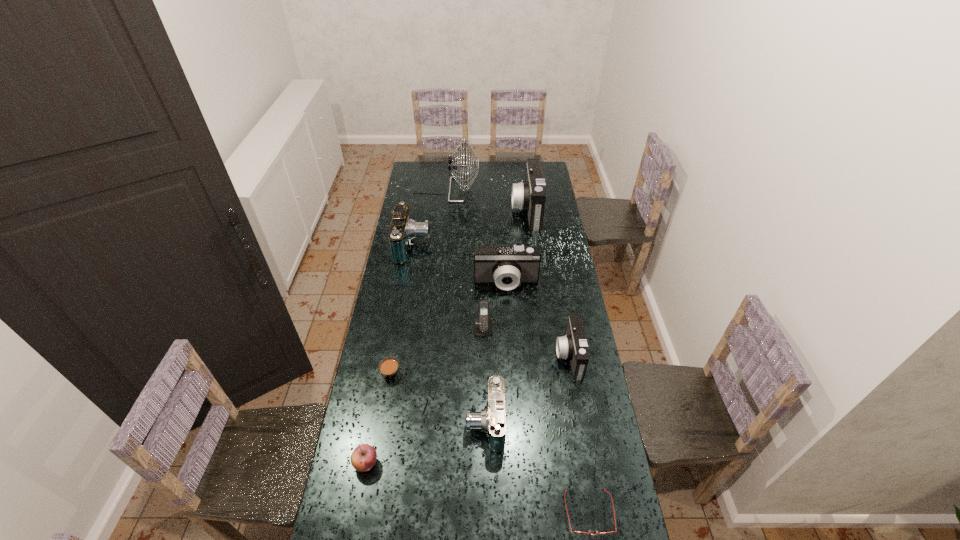
Find the location of a particular element. Image resolution: width=960 pixels, height=540 pixels. free location located on the back of the apple is located at coordinates (385, 362).

The width and height of the screenshot is (960, 540). In order to click on free location located 0.070m on the back of the brown cappuccino in this screenshot , I will do `click(396, 347)`.

Where is `object present at the far edge`? The image size is (960, 540). object present at the far edge is located at coordinates (453, 165).

Identify the location of fan situated at the left edge. (453, 165).

I want to click on camcorder positioned at the left edge, so click(x=403, y=229).

At what (x,y) coordinates should I click in order to perform the action: click on apple that is at the left edge. Please return your answer as a coordinate pair (x, y). Looking at the image, I should click on (363, 458).

Find the location of `cappuccino at the left edge`. cappuccino at the left edge is located at coordinates [390, 371].

This screenshot has height=540, width=960. What are the coordinates of `spectacles that is at the right edge` in the screenshot? It's located at (575, 532).

The height and width of the screenshot is (540, 960). I want to click on object that is at the far left corner, so click(453, 165).

In the image, there is a desktop. Where is `blank space at the far edge`? blank space at the far edge is located at coordinates (498, 168).